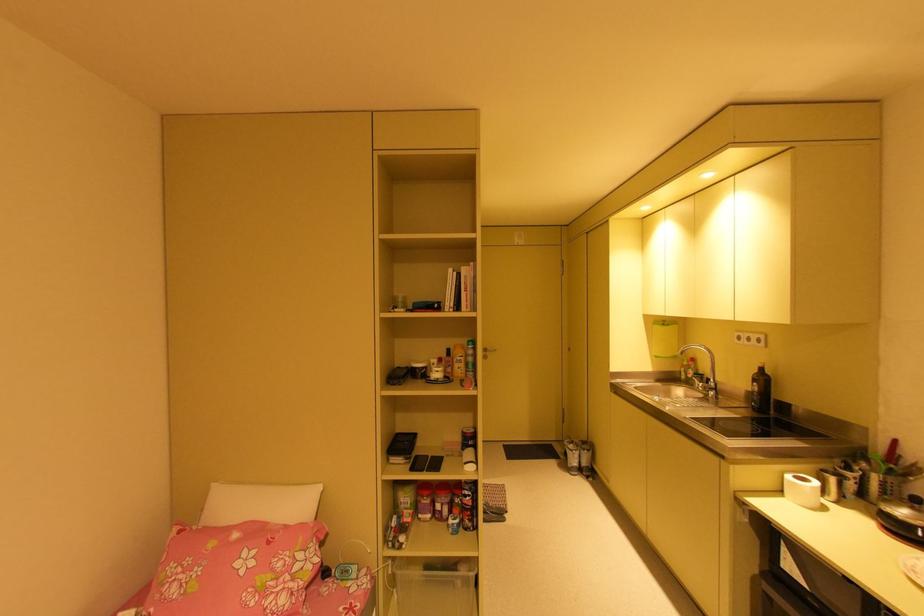
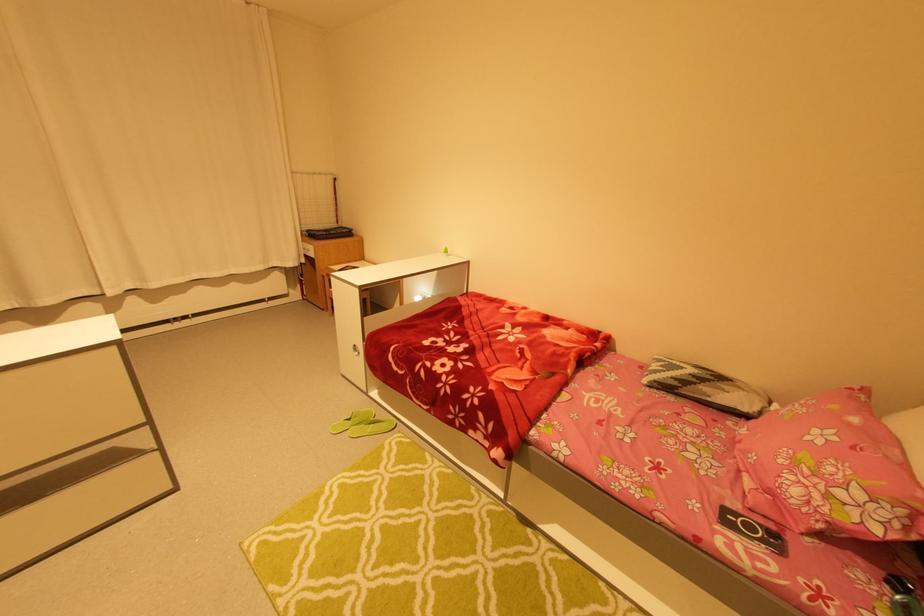
Find the pixel in the second image that matches (x=317, y=549) in the first image.

(891, 515)